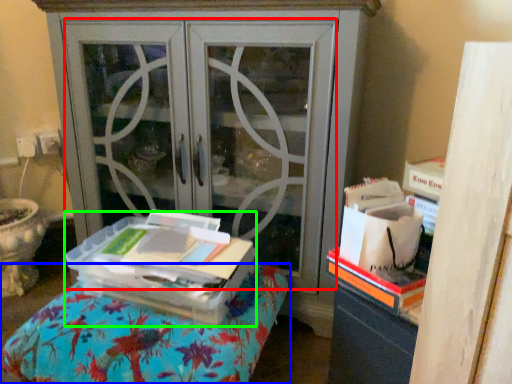
Question: Based on their relative distances, which object is farther from screen door (highlighted by a red box)? Choose from furniture (highlighted by a blue box) and cardboard box (highlighted by a green box).

Choices:
 (A) furniture
 (B) cardboard box

Answer: (A)